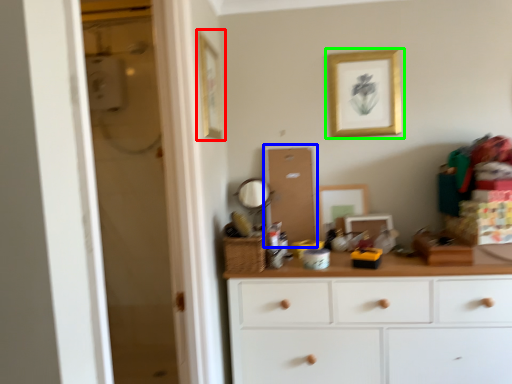
Question: Based on their relative distances, which object is nearer to picture frame (highlighted by a red box)? Choose from screen door (highlighted by a blue box) and picture frame (highlighted by a green box).

Choices:
 (A) screen door
 (B) picture frame

Answer: (A)